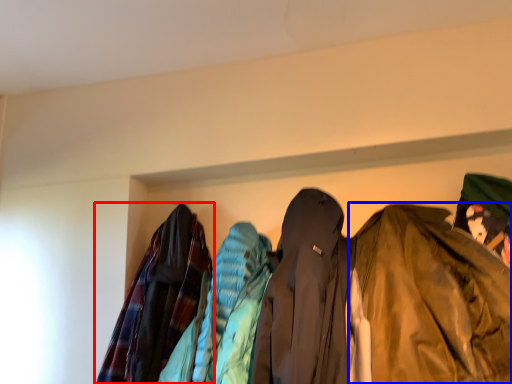
Question: Which object appears farthest to the camera in this image, jacket (highlighted by a red box) or jacket (highlighted by a blue box)?

Choices:
 (A) jacket
 (B) jacket

Answer: (A)